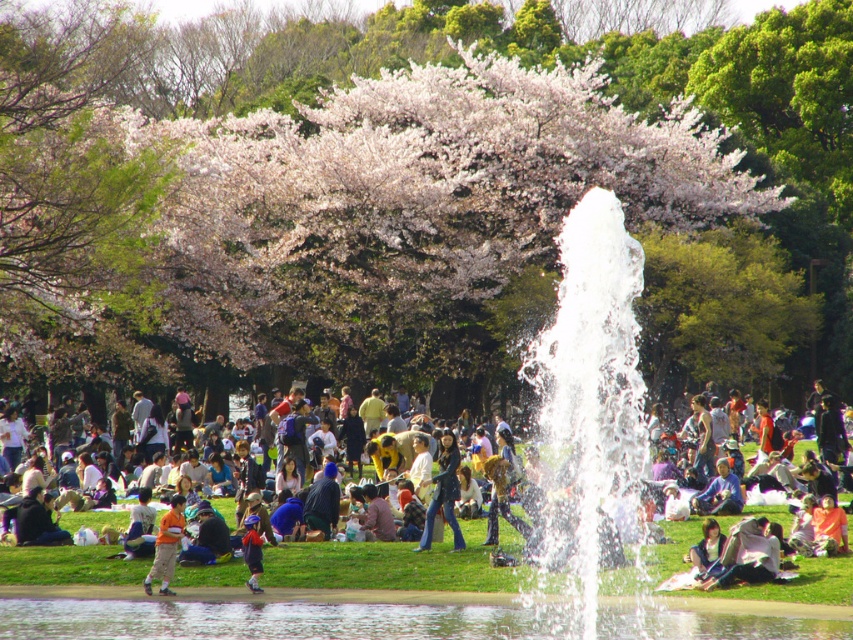
You are at the park and see a person wearing a matte black jacket at center and another wearing an orange cotton shirt at lower left. Which clothing item is positioned more to the east?

The matte black jacket at center is positioned more to the east than the orange cotton shirt at lower left.

You are a photographer planning to take a wide shot of the park scene. The white blossoming tree at upper center and the blue denim jacket at lower center are both in your frame. Based on their sizes in the image, which object would appear larger in your photo?

The white blossoming tree at upper center would appear larger in the photo because its width surpasses that of the blue denim jacket at lower center, as stated in the description.